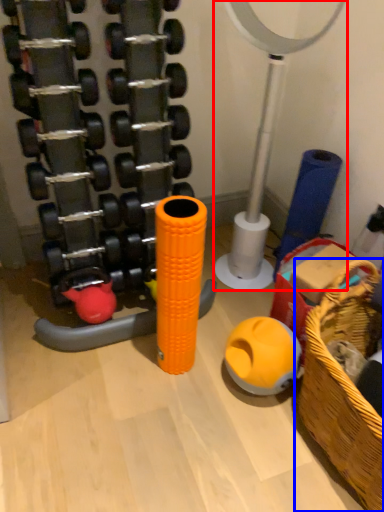
Question: Which object is closer to the camera taking this photo, basketball hoop (highlighted by a red box) or basket (highlighted by a blue box)?

Choices:
 (A) basketball hoop
 (B) basket

Answer: (B)